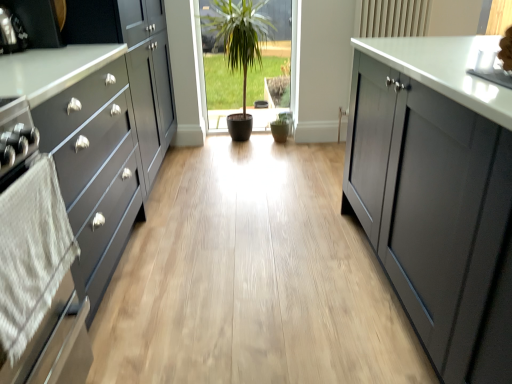
Describe the element at coordinates (252, 278) in the screenshot. I see `matte black oven at left` at that location.

In order to face white textured towel at left, should I rotate leftwards or rightwards?

You should rotate left by 28.281 degrees.

The width and height of the screenshot is (512, 384). What are the coordinates of `matte black cabinet at left` in the screenshot? It's located at (105, 125).

The width and height of the screenshot is (512, 384). In order to click on matte black oven at left in this screenshot , I will do `click(252, 278)`.

Considering the sizes of matte black cabinet at left and matte black oven at left in the image, is matte black cabinet at left wider or thinner than matte black oven at left?

Clearly, matte black cabinet at left has less width compared to matte black oven at left.

From a real-world perspective, is matte black cabinet at left positioned under matte black oven at left based on gravity?

No, from a real-world perspective, matte black cabinet at left is not beneath matte black oven at left.

Are matte black cabinet at left and matte black oven at left located far from each other?

No, matte black cabinet at left is not far from matte black oven at left.

The image size is (512, 384). In order to click on cabinetry in front of the matte black oven at left in this screenshot , I will do `click(105, 125)`.

Considering the sizes of matte black oven at left and green matte potted plant at center in the image, is matte black oven at left taller or shorter than green matte potted plant at center?

In the image, matte black oven at left appears to be shorter than green matte potted plant at center.

From the image's perspective, is matte black oven at left over green matte potted plant at center?

Actually, matte black oven at left appears below green matte potted plant at center in the image.

Consider the image. Is matte black oven at left located outside green matte potted plant at center?

That's correct, matte black oven at left is outside of green matte potted plant at center.

Looking at this image, is green matte potted plant at center at the back of matte black oven at left?

No, matte black oven at left is not facing away from green matte potted plant at center.

How many degrees apart are the facing directions of matte black cabinet at left and white textured towel at left?

The angle between the facing direction of matte black cabinet at left and the facing direction of white textured towel at left is 0.709 degrees.

Is matte black cabinet at left in contact with white textured towel at left?

No.

Between point (74, 194) and point (12, 192), which one is positioned behind?

Point (74, 194)

Is matte black cabinet at left taller than white textured towel at left?

Yes, matte black cabinet at left is taller than white textured towel at left.

Is the position of matte black oven at left more distant than that of matte black cabinet at left?

Yes, it is.

From the picture: In terms of height, does matte black oven at left look taller or shorter compared to matte black cabinet at left?

In the image, matte black oven at left appears to be shorter than matte black cabinet at left.

Is there a large distance between matte black oven at left and matte black cabinet at left?

No.

Locate an element on the screen. This screenshot has width=512, height=384. plain behind the matte black cabinet at left is located at coordinates (252, 278).

Could you tell me if white textured towel at left is turned towards matte black oven at left?

No, white textured towel at left is not facing towards matte black oven at left.

From a real-world perspective, relative to matte black oven at left, is white textured towel at left vertically above or below?

In terms of real-world spatial position, white textured towel at left is above matte black oven at left.

From the image's perspective, is white textured towel at left on top of matte black oven at left?

Actually, white textured towel at left appears below matte black oven at left in the image.

Is white textured towel at left to the right of matte black oven at left from the viewer's perspective?

Incorrect, white textured towel at left is not on the right side of matte black oven at left.

Is point (253, 18) closer or farther from the camera than point (125, 192)?

Point (253, 18) appears to be farther away from the viewer than point (125, 192).

Is there a large distance between green matte potted plant at center and matte black cabinet at left?

green matte potted plant at center is far away from matte black cabinet at left.

Which object is closer to the camera taking this photo, green matte potted plant at center or matte black cabinet at left?

matte black cabinet at left is more forward.

Between green matte potted plant at center and matte black cabinet at left, which one appears on the right side from the viewer's perspective?

From the viewer's perspective, green matte potted plant at center appears more on the right side.

Which is correct: green matte potted plant at center is inside matte black oven at left, or outside of it?

The correct answer is: outside.

Are green matte potted plant at center and matte black oven at left making contact?

green matte potted plant at center is not next to matte black oven at left, and they're not touching.

Between green matte potted plant at center and matte black oven at left, which one has smaller size?

green matte potted plant at center.

Could you tell me if green matte potted plant at center is turned towards matte black oven at left?

Yes, green matte potted plant at center is aimed at matte black oven at left.

At what (x,y) coordinates should I click in order to perform the action: click on plain lying behind the matte black cabinet at left. Please return your answer as a coordinate pair (x, y). The width and height of the screenshot is (512, 384). Looking at the image, I should click on (252, 278).

Where is `houseplant on the left of matte black oven at left`? houseplant on the left of matte black oven at left is located at coordinates (239, 48).

When comparing their distances from matte black cabinet at left, does white textured towel at left or matte black oven at left seem closer?

white textured towel at left lies closer to matte black cabinet at left than the other object.

When comparing their distances from green matte potted plant at center, does matte black oven at left or white textured towel at left seem further?

white textured towel at left lies further to green matte potted plant at center than the other object.

Considering their positions, is green matte potted plant at center positioned closer to matte black cabinet at left than white textured towel at left?

Based on the image, white textured towel at left appears to be nearer to matte black cabinet at left.

Which object lies nearer to the anchor point matte black oven at left, matte black cabinet at left or white textured towel at left?

Based on the image, matte black cabinet at left appears to be nearer to matte black oven at left.

From the image, which object appears to be farther from white textured towel at left, matte black oven at left or green matte potted plant at center?

green matte potted plant at center is positioned further to the anchor white textured towel at left.

From the image, which object appears to be farther from green matte potted plant at center, white textured towel at left or matte black oven at left?

white textured towel at left.

Estimate the real-world distances between objects in this image. Which object is closer to green matte potted plant at center, matte black cabinet at left or matte black oven at left?

Based on the image, matte black cabinet at left appears to be nearer to green matte potted plant at center.

Looking at the image, which one is located further to matte black cabinet at left, matte black oven at left or white textured towel at left?

Among the two, matte black oven at left is located further to matte black cabinet at left.

What are the coordinates of `oven situated between matte black cabinet at left and matte black oven at left from left to right` in the screenshot? It's located at (40, 283).

This screenshot has width=512, height=384. Find the location of `plain between white textured towel at left and green matte potted plant at center along the z-axis`. plain between white textured towel at left and green matte potted plant at center along the z-axis is located at coordinates (252, 278).

Locate an element on the screen. cabinetry between white textured towel at left and green matte potted plant at center from front to back is located at coordinates (105, 125).

This screenshot has height=384, width=512. I want to click on plain located between matte black cabinet at left and green matte potted plant at center in the depth direction, so click(252, 278).